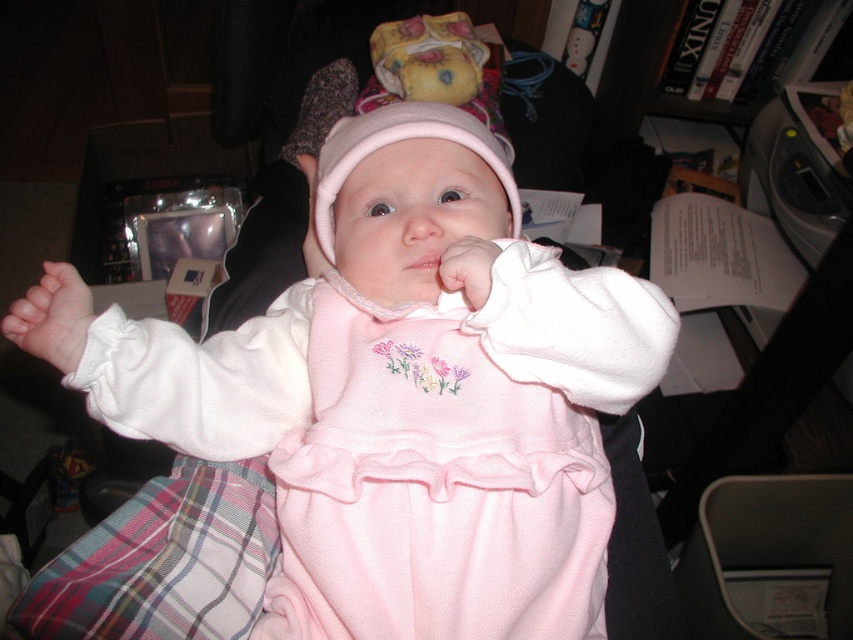
Is pink fabric hat at center positioned at the back of pink soft fabric hand at center?

Yes, it is behind pink soft fabric hand at center.

Is pink fabric hat at center thinner than pink soft fabric hand at center?

Incorrect, pink fabric hat at center's width is not less than pink soft fabric hand at center's.

What do you see at coordinates (416, 108) in the screenshot? I see `pink fabric hat at center` at bounding box center [416, 108].

Find the location of a particular element. This screenshot has height=640, width=853. pink fabric hat at center is located at coordinates (416, 108).

Can you confirm if pink cotton dress at center is thinner than pink fabric hand at center?

No.

At what (x,y) coordinates should I click in order to perform the action: click on pink cotton dress at center. Please return your answer as a coordinate pair (x, y). This screenshot has height=640, width=853. Looking at the image, I should click on (444, 467).

Describe the element at coordinates (444, 467) in the screenshot. I see `pink cotton dress at center` at that location.

This screenshot has height=640, width=853. I want to click on pink cotton dress at center, so click(444, 467).

Is pink cotton dress at center to the left of pink soft fabric hand at center from the viewer's perspective?

Indeed, pink cotton dress at center is positioned on the left side of pink soft fabric hand at center.

Which is more to the left, pink cotton dress at center or pink soft fabric hand at center?

pink cotton dress at center

Locate an element on the screen. The height and width of the screenshot is (640, 853). pink cotton dress at center is located at coordinates (444, 467).

Where is `pink cotton dress at center`? pink cotton dress at center is located at coordinates (444, 467).